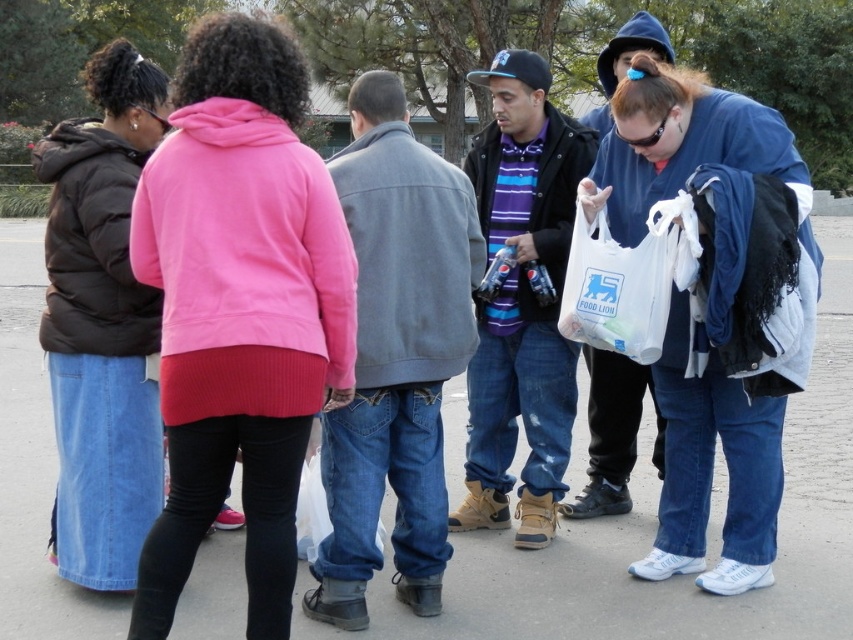
Question: Can you confirm if denim jeans at center is smaller than white plastic bag at center?

Choices:
 (A) no
 (B) yes

Answer: (A)

Question: Is denim jeans at center positioned behind striped cotton shirt at center?

Choices:
 (A) no
 (B) yes

Answer: (A)

Question: Among these objects, which one is nearest to the camera?

Choices:
 (A) denim jeans at center
 (B) white plastic bag at center
 (C) striped cotton shirt at center

Answer: (A)

Question: Which of the following is the farthest from the observer?

Choices:
 (A) (660, 316)
 (B) (341, 186)

Answer: (A)

Question: Which point appears farthest from the camera in this image?

Choices:
 (A) (454, 333)
 (B) (569, 228)
 (C) (611, 342)

Answer: (B)

Question: Is denim jeans at center closer to the viewer compared to white plastic bag at center?

Choices:
 (A) yes
 (B) no

Answer: (A)